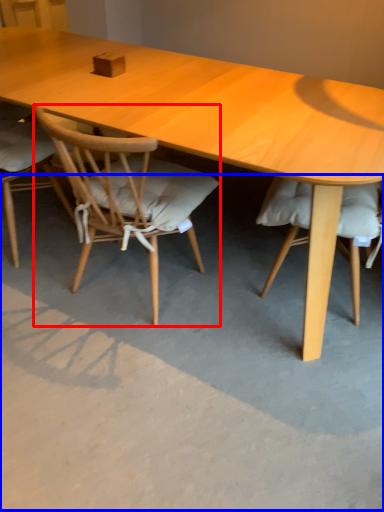
Question: Which point is closer to the camera, chair (highlighted by a red box) or concrete (highlighted by a blue box)?

Choices:
 (A) chair
 (B) concrete

Answer: (B)